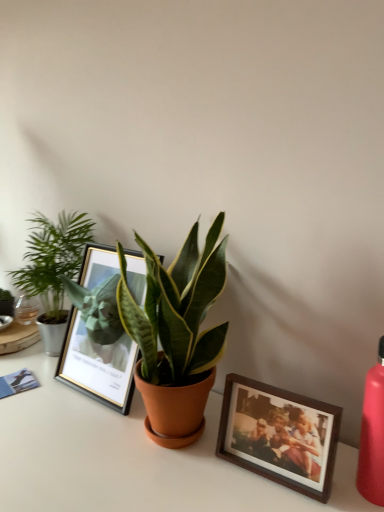
Measure the distance between metallic gold picture frame at center, which is the 2th picture frame in right-to-left order, and camera.

A distance of 32.40 inches exists between metallic gold picture frame at center, which is the 2th picture frame in right-to-left order, and camera.

Find the location of `green glossy houseplant at center, which appears as the 2th houseplant when viewed from the back`. green glossy houseplant at center, which appears as the 2th houseplant when viewed from the back is located at coordinates (176, 331).

Which of these two, green leafy plant at left, which ranks as the 1th houseplant in left-to-right order, or metallic gold picture frame at center, positioned as the first picture frame in left-to-right order, is smaller?

green leafy plant at left, which ranks as the 1th houseplant in left-to-right order, is smaller.

Where is `the 1st houseplant located above the metallic gold picture frame at center, which is the 2th picture frame in right-to-left order (from a real-world perspective)`? The width and height of the screenshot is (384, 512). the 1st houseplant located above the metallic gold picture frame at center, which is the 2th picture frame in right-to-left order (from a real-world perspective) is located at coordinates (53, 268).

Considering the sizes of objects green leafy plant at left, marked as the 2th houseplant in a right-to-left arrangement, and metallic gold picture frame at center, which is the 2th picture frame in front-to-back order, in the image provided, who is shorter, green leafy plant at left, marked as the 2th houseplant in a right-to-left arrangement, or metallic gold picture frame at center, which is the 2th picture frame in front-to-back order,?

metallic gold picture frame at center, which is the 2th picture frame in front-to-back order.

Is green leafy plant at left, the second houseplant when ordered from front to back, next to metallic gold picture frame at center, positioned as the first picture frame in left-to-right order?

No, green leafy plant at left, the second houseplant when ordered from front to back, is not making contact with metallic gold picture frame at center, positioned as the first picture frame in left-to-right order.

Based on the photo, can you confirm if metallic gold picture frame at center, which is the 2th picture frame in front-to-back order, is shorter than matte red bottle at right?

No, metallic gold picture frame at center, which is the 2th picture frame in front-to-back order, is not shorter than matte red bottle at right.

Is metallic gold picture frame at center, which is the 2th picture frame in front-to-back order, outside of matte red bottle at right?

metallic gold picture frame at center, which is the 2th picture frame in front-to-back order, is positioned outside matte red bottle at right.

Is metallic gold picture frame at center, which is the 2th picture frame in right-to-left order, further to camera compared to matte red bottle at right?

Yes, metallic gold picture frame at center, which is the 2th picture frame in right-to-left order, is further from the camera.

Looking at this image, how far apart are metallic gold picture frame at center, which is the 2th picture frame in front-to-back order, and matte red bottle at right?

metallic gold picture frame at center, which is the 2th picture frame in front-to-back order, is 20.77 inches from matte red bottle at right.

Is matte red bottle at right taller or shorter than green glossy houseplant at center, which is the 1th houseplant from front to back?

In the image, matte red bottle at right appears to be shorter than green glossy houseplant at center, which is the 1th houseplant from front to back.

Is point (371, 478) behind point (179, 374)?

No, (371, 478) is closer to viewer.

At what (x,y) coordinates should I click in order to perform the action: click on houseplant that is the 2nd object above the matte red bottle at right (from a real-world perspective). Please return your answer as a coordinate pair (x, y). The image size is (384, 512). Looking at the image, I should click on (176, 331).

Is green glossy houseplant at center, which ranks as the second houseplant in left-to-right order, at the back of matte red bottle at right?

No, matte red bottle at right's orientation is not away from green glossy houseplant at center, which ranks as the second houseplant in left-to-right order.

Looking at their sizes, would you say metallic gold picture frame at center, positioned as the 1th picture frame in back-to-front order, is wider or thinner than white glossy table at center?

In the image, metallic gold picture frame at center, positioned as the 1th picture frame in back-to-front order, appears to be more narrow than white glossy table at center.

Is metallic gold picture frame at center, which is the 2th picture frame in front-to-back order, oriented towards white glossy table at center?

No, metallic gold picture frame at center, which is the 2th picture frame in front-to-back order, is not turned towards white glossy table at center.

From a real-world perspective, who is located higher, metallic gold picture frame at center, which is the 2th picture frame in right-to-left order, or white glossy table at center?

From a 3D spatial view, metallic gold picture frame at center, which is the 2th picture frame in right-to-left order, is above.

Considering the sizes of metallic gold picture frame at center, positioned as the 1th picture frame in back-to-front order, and white glossy table at center in the image, is metallic gold picture frame at center, positioned as the 1th picture frame in back-to-front order, bigger or smaller than white glossy table at center?

Clearly, metallic gold picture frame at center, positioned as the 1th picture frame in back-to-front order, is smaller in size than white glossy table at center.

Does matte red bottle at right have a larger size compared to white glossy table at center?

No, matte red bottle at right is not bigger than white glossy table at center.

From a real-world perspective, is matte red bottle at right on white glossy table at center?

Correct, in the physical world, matte red bottle at right is higher than white glossy table at center.

Are matte red bottle at right and white glossy table at center beside each other?

No, matte red bottle at right is not touching white glossy table at center.

Looking at this image, can green glossy houseplant at center, which is the 1th houseplant from front to back, be found inside white glossy table at center?

No, white glossy table at center does not contain green glossy houseplant at center, which is the 1th houseplant from front to back.

From the image's perspective, is white glossy table at center located beneath green glossy houseplant at center, positioned as the 1th houseplant in right-to-left order?

Yes, from the image's perspective, white glossy table at center is below green glossy houseplant at center, positioned as the 1th houseplant in right-to-left order.

Which point is more forward, [59,392] or [139,328]?

Positioned in front is point [139,328].

Based on their sizes in the image, would you say white glossy table at center is bigger or smaller than green glossy houseplant at center, which is the 1th houseplant from front to back?

Clearly, white glossy table at center is larger in size than green glossy houseplant at center, which is the 1th houseplant from front to back.

Looking at the image, does wooden photo frame at lower right, the first picture frame viewed from the right, seem bigger or smaller compared to white glossy table at center?

Clearly, wooden photo frame at lower right, the first picture frame viewed from the right, is smaller in size than white glossy table at center.

From a real-world perspective, is wooden photo frame at lower right, the first picture frame viewed from the right, beneath white glossy table at center?

No, from a real-world perspective, wooden photo frame at lower right, the first picture frame viewed from the right, is not below white glossy table at center.

Is wooden photo frame at lower right, the first picture frame viewed from the right, next to white glossy table at center and touching it?

No, wooden photo frame at lower right, the first picture frame viewed from the right, is not next to white glossy table at center.

Between wooden photo frame at lower right, the first picture frame viewed from the right, and white glossy table at center, which one has larger width?

Wider between the two is white glossy table at center.

Locate an element on the screen. The width and height of the screenshot is (384, 512). the 1st houseplant located above the metallic gold picture frame at center, which is the 2th picture frame in right-to-left order (from a real-world perspective) is located at coordinates (53, 268).

Locate an element on the screen. bottle in front of the metallic gold picture frame at center, positioned as the 1th picture frame in back-to-front order is located at coordinates (372, 434).

Based on their spatial positions, is green leafy plant at left, which appears as the first houseplant when viewed from the back, or green glossy houseplant at center, which is the 1th houseplant from front to back, closer to white glossy table at center?

The object closer to white glossy table at center is green glossy houseplant at center, which is the 1th houseplant from front to back.

Looking at the image, which one is located further to wooden photo frame at lower right, the second picture frame when ordered from back to front, green glossy houseplant at center, positioned as the 1th houseplant in right-to-left order, or white glossy table at center?

green glossy houseplant at center, positioned as the 1th houseplant in right-to-left order.

When comparing their distances from metallic gold picture frame at center, positioned as the first picture frame in left-to-right order, does matte red bottle at right or green glossy houseplant at center, which appears as the 2th houseplant when viewed from the back, seem closer?

The object closer to metallic gold picture frame at center, positioned as the first picture frame in left-to-right order, is green glossy houseplant at center, which appears as the 2th houseplant when viewed from the back.

Considering their positions, is green glossy houseplant at center, which appears as the 2th houseplant when viewed from the back, positioned further to metallic gold picture frame at center, which is the 2th picture frame in front-to-back order, than white glossy table at center?

white glossy table at center is positioned further to the anchor metallic gold picture frame at center, which is the 2th picture frame in front-to-back order.

Consider the image. Considering their positions, is metallic gold picture frame at center, which is the 2th picture frame in front-to-back order, positioned closer to white glossy table at center than green leafy plant at left, which appears as the first houseplant when viewed from the back?

The object closer to white glossy table at center is metallic gold picture frame at center, which is the 2th picture frame in front-to-back order.

Which object lies further to the anchor point green leafy plant at left, which ranks as the 1th houseplant in left-to-right order, matte red bottle at right or metallic gold picture frame at center, positioned as the 1th picture frame in back-to-front order?

The object further to green leafy plant at left, which ranks as the 1th houseplant in left-to-right order, is matte red bottle at right.

Which object lies further to the anchor point green leafy plant at left, marked as the 2th houseplant in a right-to-left arrangement, wooden photo frame at lower right, positioned as the 2th picture frame in left-to-right order, or metallic gold picture frame at center, positioned as the 1th picture frame in back-to-front order?

wooden photo frame at lower right, positioned as the 2th picture frame in left-to-right order, lies further to green leafy plant at left, marked as the 2th houseplant in a right-to-left arrangement, than the other object.

Based on their spatial positions, is green glossy houseplant at center, positioned as the 1th houseplant in right-to-left order, or matte red bottle at right closer to green leafy plant at left, marked as the 2th houseplant in a right-to-left arrangement?

Based on the image, green glossy houseplant at center, positioned as the 1th houseplant in right-to-left order, appears to be nearer to green leafy plant at left, marked as the 2th houseplant in a right-to-left arrangement.

Where is `picture frame between green glossy houseplant at center, which is the 1th houseplant from front to back, and matte red bottle at right, in the horizontal direction`? This screenshot has width=384, height=512. picture frame between green glossy houseplant at center, which is the 1th houseplant from front to back, and matte red bottle at right, in the horizontal direction is located at coordinates (279, 435).

Where is `picture frame between metallic gold picture frame at center, which is the 2th picture frame in front-to-back order, and matte red bottle at right, in the horizontal direction`? picture frame between metallic gold picture frame at center, which is the 2th picture frame in front-to-back order, and matte red bottle at right, in the horizontal direction is located at coordinates (279, 435).

Image resolution: width=384 pixels, height=512 pixels. In order to click on houseplant between green leafy plant at left, the second houseplant when ordered from front to back, and white glossy table at center vertically in this screenshot , I will do `click(176, 331)`.

The width and height of the screenshot is (384, 512). What are the coordinates of `picture frame situated between green leafy plant at left, the second houseplant when ordered from front to back, and wooden photo frame at lower right, positioned as the 2th picture frame in left-to-right order, from left to right` in the screenshot? It's located at (97, 334).